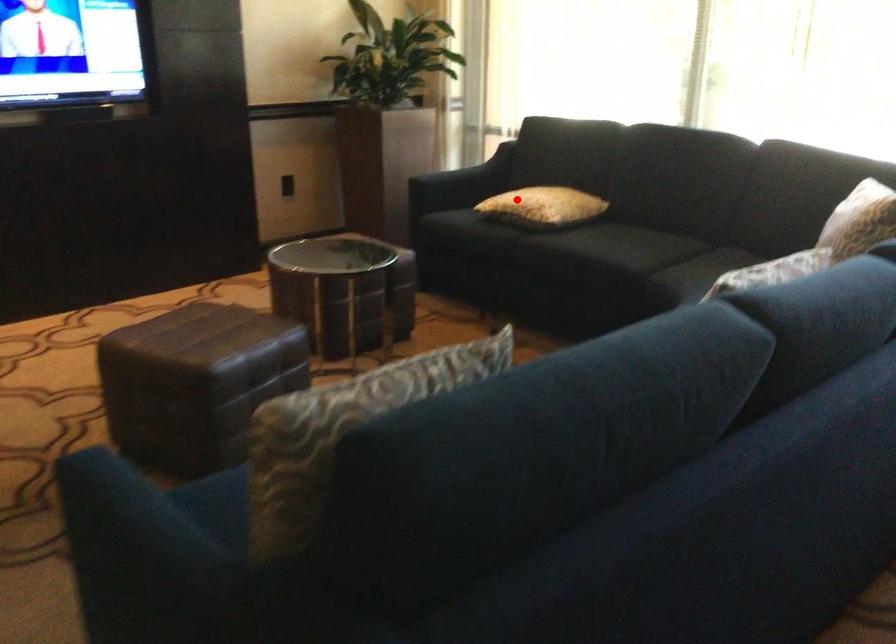
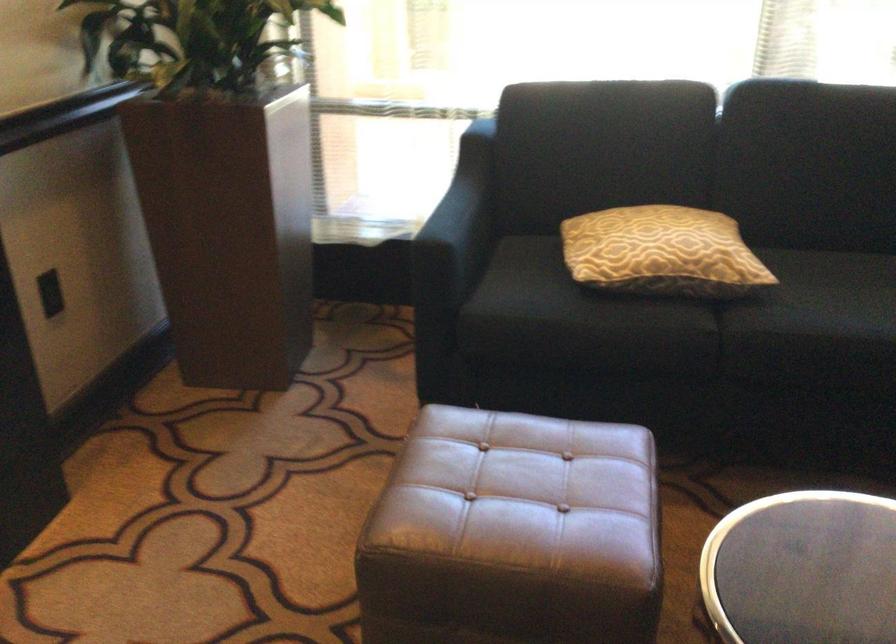
Question: I am providing you with two images of the same scene from different viewpoints. Image1 has a red point marked. In image2, the corresponding 3D location appears at what relative position? Reply with the corresponding letter.

Choices:
 (A) Closer
 (B) Farther

Answer: (A)